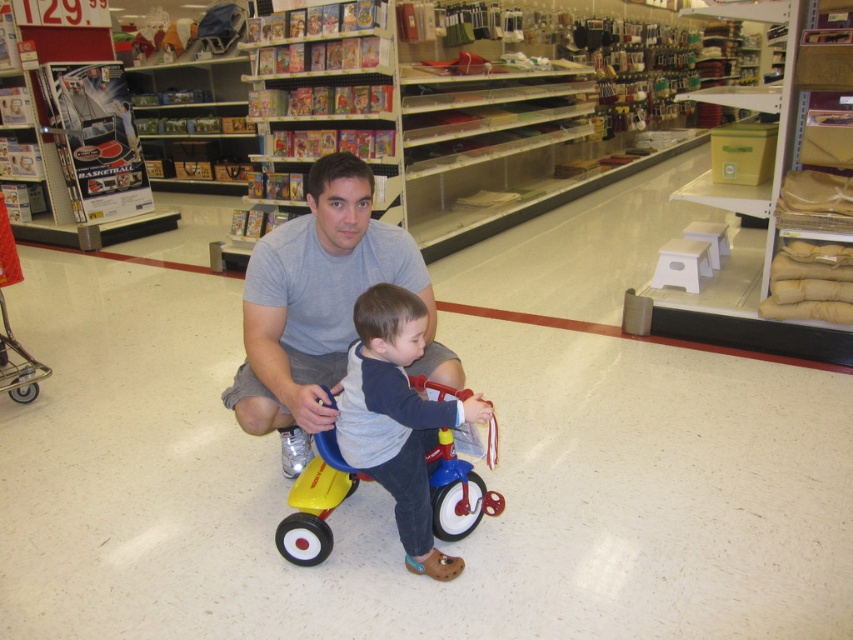
Question: Which is farther from the gray fleece shirt at center?

Choices:
 (A) metallic silver shopping cart at lower left
 (B) gray cotton shirt at center

Answer: (A)

Question: From the image, what is the correct spatial relationship of gray fleece shirt at center in relation to metallic silver shopping cart at lower left?

Choices:
 (A) below
 (B) above

Answer: (A)

Question: Which of the following is the farthest from the observer?

Choices:
 (A) (231, 404)
 (B) (9, 376)

Answer: (B)

Question: From the image, what is the correct spatial relationship of gray cotton shirt at center in relation to metallic silver shopping cart at lower left?

Choices:
 (A) right
 (B) left

Answer: (A)

Question: Observing the image, what is the correct spatial positioning of gray cotton shirt at center in reference to gray fleece shirt at center?

Choices:
 (A) above
 (B) below

Answer: (A)

Question: Which of the following is the farthest from the observer?

Choices:
 (A) (416, 508)
 (B) (247, 308)
 (C) (10, 248)

Answer: (C)